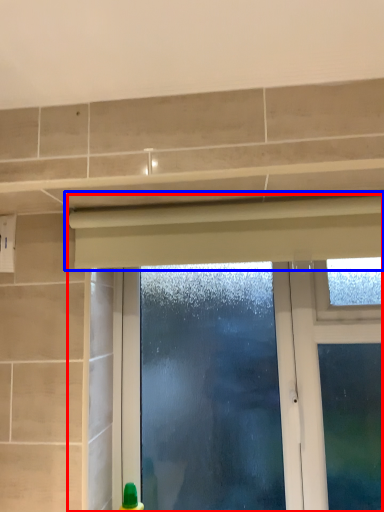
Question: Which object appears closest to the camera in this image, window (highlighted by a red box) or curtain (highlighted by a blue box)?

Choices:
 (A) window
 (B) curtain

Answer: (B)